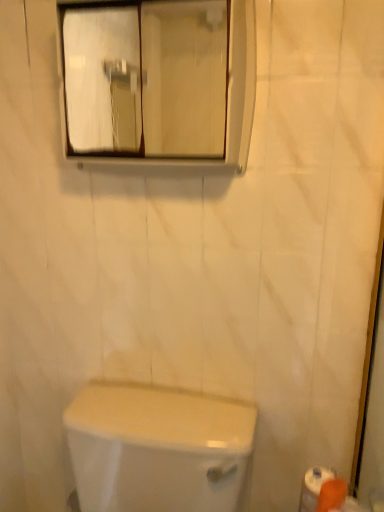
Question: Does clear glass mirror at upper center have a greater width compared to orange matte toilet paper at lower right?

Choices:
 (A) yes
 (B) no

Answer: (A)

Question: Is clear glass mirror at upper center further to the viewer compared to orange matte toilet paper at lower right?

Choices:
 (A) yes
 (B) no

Answer: (B)

Question: Can we say clear glass mirror at upper center lies outside orange matte toilet paper at lower right?

Choices:
 (A) no
 (B) yes

Answer: (B)

Question: Can you see clear glass mirror at upper center touching orange matte toilet paper at lower right?

Choices:
 (A) yes
 (B) no

Answer: (B)

Question: From the image's perspective, does clear glass mirror at upper center appear lower than orange matte toilet paper at lower right?

Choices:
 (A) yes
 (B) no

Answer: (B)

Question: Does clear glass mirror at upper center appear on the right side of orange matte toilet paper at lower right?

Choices:
 (A) no
 (B) yes

Answer: (A)

Question: Is orange matte toilet paper at lower right completely or partially outside of white glossy toilet at lower center?

Choices:
 (A) no
 (B) yes

Answer: (B)

Question: Is orange matte toilet paper at lower right further to camera compared to white glossy toilet at lower center?

Choices:
 (A) yes
 (B) no

Answer: (A)

Question: Is orange matte toilet paper at lower right at the left side of white glossy toilet at lower center?

Choices:
 (A) yes
 (B) no

Answer: (B)

Question: Considering the relative sizes of orange matte toilet paper at lower right and white glossy toilet at lower center in the image provided, is orange matte toilet paper at lower right smaller than white glossy toilet at lower center?

Choices:
 (A) yes
 (B) no

Answer: (A)

Question: Is orange matte toilet paper at lower right shorter than white glossy toilet at lower center?

Choices:
 (A) no
 (B) yes

Answer: (B)

Question: Is orange matte toilet paper at lower right taller than white glossy toilet at lower center?

Choices:
 (A) no
 (B) yes

Answer: (A)

Question: Is orange matte toilet paper at lower right aimed at clear glass mirror at upper center?

Choices:
 (A) yes
 (B) no

Answer: (B)